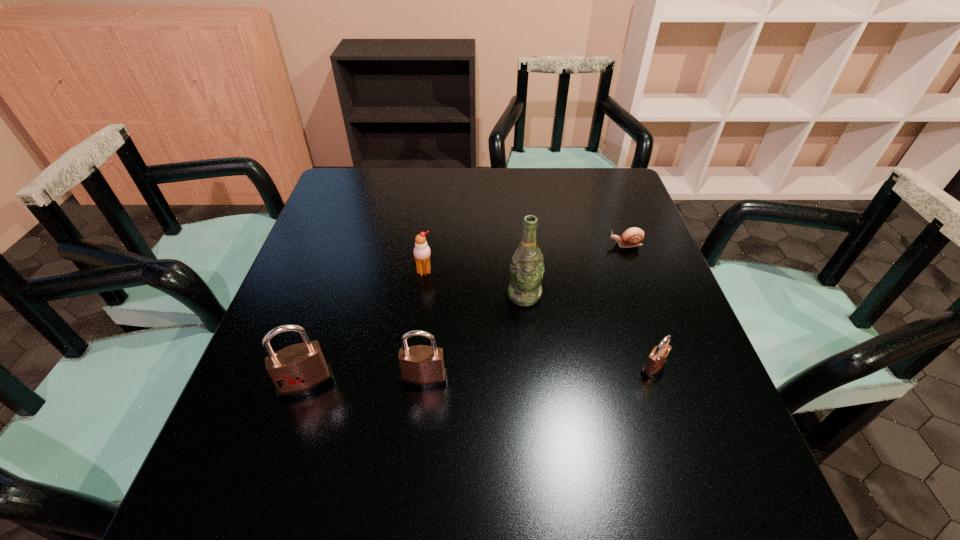
Where is `the leftmost padlock`? the leftmost padlock is located at coordinates (298, 370).

Identify the location of the second padlock from left to right. Image resolution: width=960 pixels, height=540 pixels. (422, 366).

This screenshot has width=960, height=540. Find the location of `the second tallest padlock`. the second tallest padlock is located at coordinates (422, 366).

Identify the location of the rightmost padlock. This screenshot has width=960, height=540. (657, 359).

Where is `the fifth tallest object`? the fifth tallest object is located at coordinates (657, 359).

Locate an element on the screen. This screenshot has height=540, width=960. the fifth nearest object is located at coordinates (421, 250).

I want to click on icecream, so click(421, 250).

Find the location of a particular element. the fourth nearest object is located at coordinates (526, 271).

Where is `the tallest object`? This screenshot has height=540, width=960. the tallest object is located at coordinates click(526, 271).

I want to click on escargot, so click(632, 237).